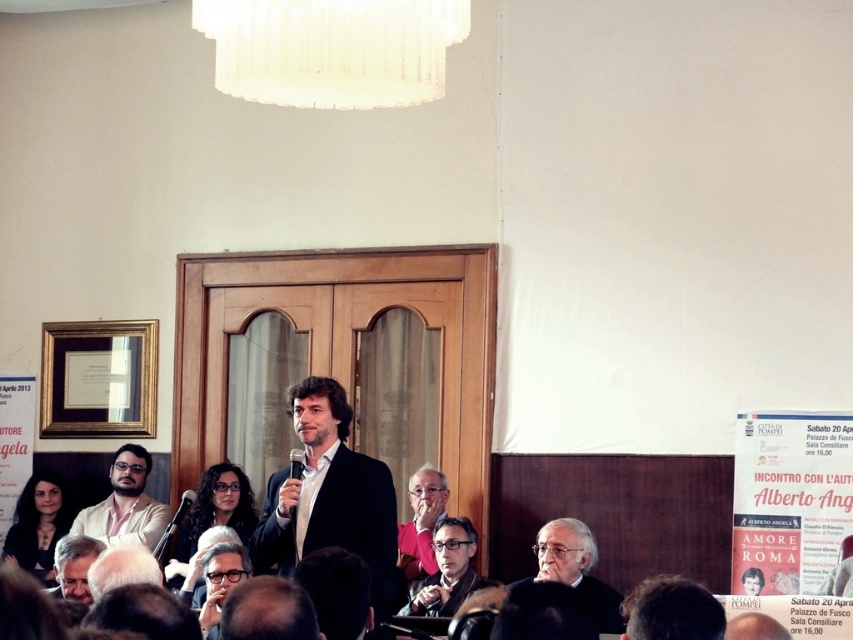
You are a photographer standing at the back of the room. You want to take a photo of the matte black jacket at center and the gray hair at lower left in the same frame. The camera you are using has a maximum focus range of 9 feet. Will both subjects be in focus?

The matte black jacket at center is 8.98 feet away from the gray hair at lower left. Since the distance between them is within the camera maximum focus range of 9 feet, both subjects will be in focus.

You are standing in the room and want to locate the matte white shirt at lower left. What are the coordinates where you can find it?

The coordinates where you can find the matte white shirt at lower left are at point (125, 502).

You are standing at the point labeled as point (447, 572) in the image. What object are you currently standing on?

The point (447, 572) is on the matte black jacket at center.